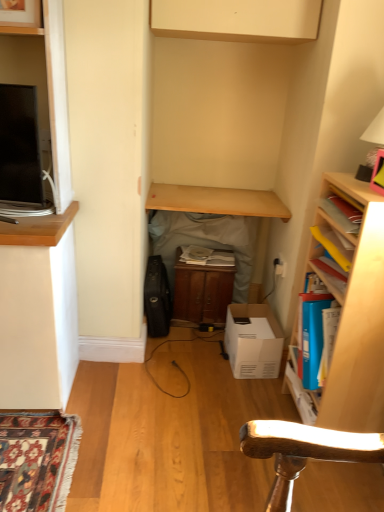
You are a GUI agent. You are given a task and a screenshot of the screen. Output one action in this format:
    pyautogui.click(x=<x>, y=<y>)
    Task: Click on the vacant space situated above wooden cabinet at center (from a real-world perspective)
    This screenshot has height=512, width=384.
    Given the screenshot: What is the action you would take?
    click(210, 256)